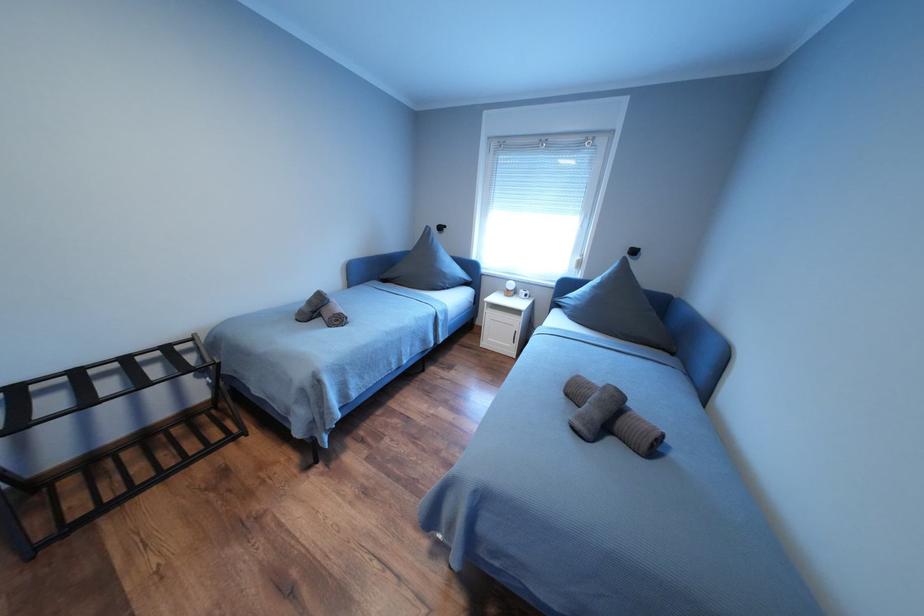
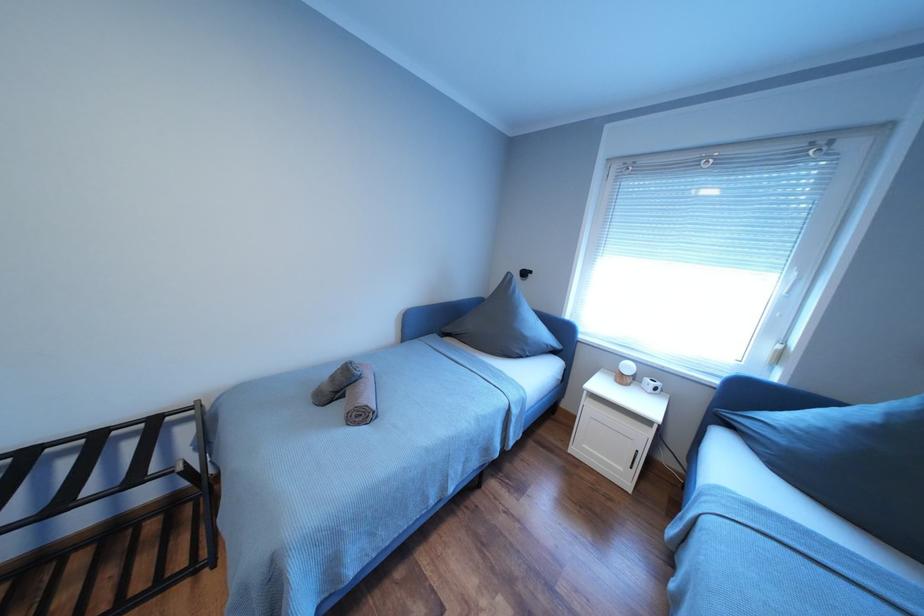
Question: The camera is either moving clockwise (left) or counter-clockwise (right) around the object. The first image is from the beginning of the video and the second image is from the end. Is the camera moving left or right when shooting the video?

Choices:
 (A) Left
 (B) Right

Answer: (B)